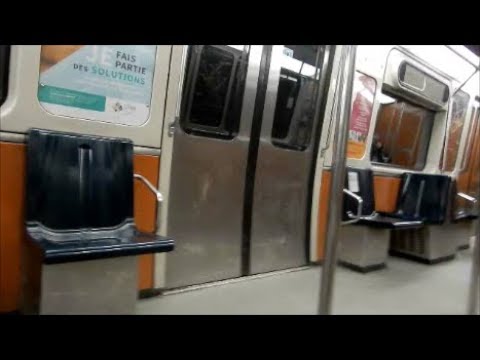
Find the location of `window`. window is located at coordinates (226, 114).